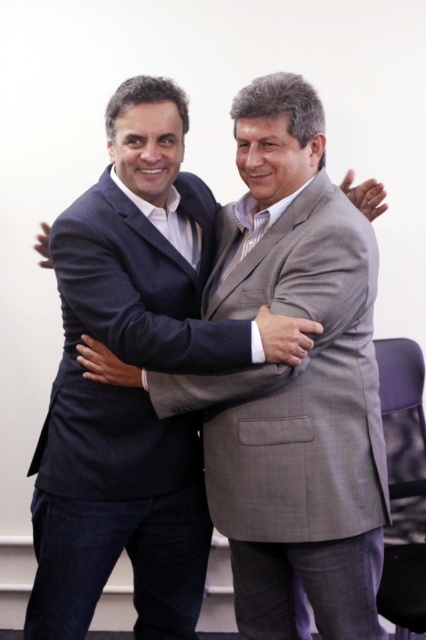
You are a photographer at a conference and need to adjust the lighting so that both the matte black suit at center and the matte black suit at left are evenly illuminated. Since the background is white, which suit might currently be in shadow and require more light?

The matte black suit at left is behind matte black suit at center, so it might be in shadow and require more light to ensure even illumination with the matte black suit at center.

You are a tailor who needs to compare the sizes of two matte black suits. You see the matte black suit at center and the matte black suit at left in the image. Which one requires more fabric to make?

The matte black suit at center requires more fabric because its width is larger than the matte black suit at left.